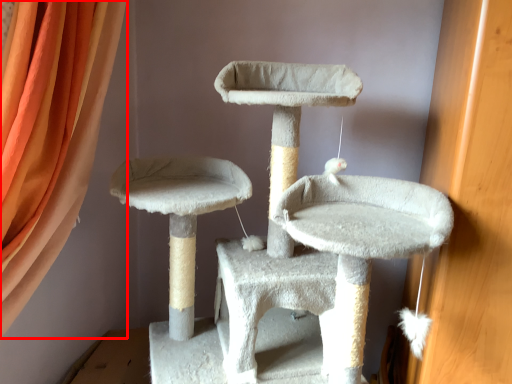
Question: Considering the relative positions of curtain (annotated by the red box) and cat furniture in the image provided, where is curtain (annotated by the red box) located with respect to the staircase?

Choices:
 (A) left
 (B) right

Answer: (A)